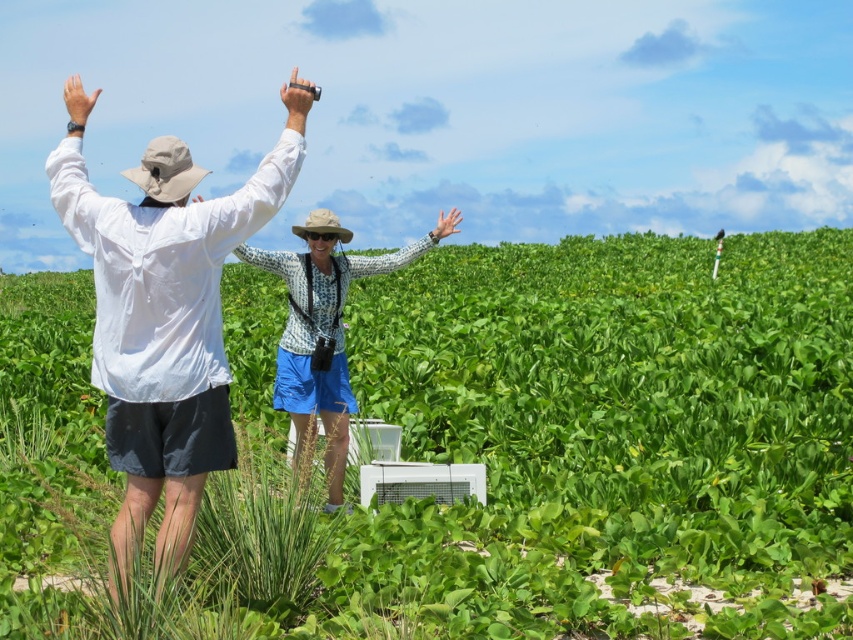
Question: Which of the following is the closest to the observer?

Choices:
 (A) (292, 106)
 (B) (247, 260)

Answer: (A)

Question: Which point is farther from the camera taking this photo?

Choices:
 (A) (312, 388)
 (B) (431, 230)

Answer: (B)

Question: Is white matte camera at upper center thinner than patterned fabric arm at center?

Choices:
 (A) yes
 (B) no

Answer: (A)

Question: Among these objects, which one is nearest to the camera?

Choices:
 (A) patterned fabric arm at center
 (B) white matte camera at upper center
 (C) patterned fabric shirt at center
 (D) matte black flashlight at upper center

Answer: (B)

Question: Does white matte shirt at left have a smaller size compared to white matte camera at upper center?

Choices:
 (A) no
 (B) yes

Answer: (A)

Question: Is green leafy plant at center wider than matte black flashlight at upper center?

Choices:
 (A) yes
 (B) no

Answer: (A)